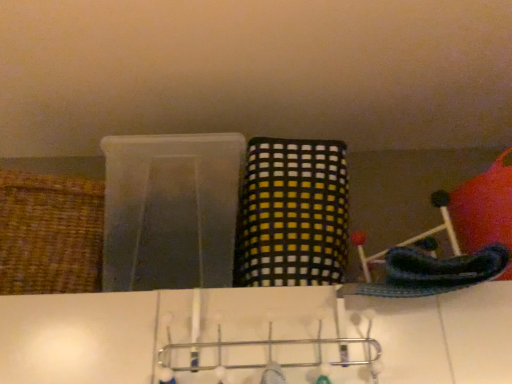
Measure the distance between yellow checkered fabric basket at center, which appears as the 2th basket when viewed from the left, and camera.

The distance of yellow checkered fabric basket at center, which appears as the 2th basket when viewed from the left, from camera is 3.33 feet.

Find the location of `metallic silver hanger at center`. metallic silver hanger at center is located at coordinates (269, 353).

Which of these two, woven brown basket at left, which ranks as the second basket in right-to-left order, or yellow checkered fabric basket at center, which is the first basket in right-to-left order, is thinner?

yellow checkered fabric basket at center, which is the first basket in right-to-left order.

You are a GUI agent. You are given a task and a screenshot of the screen. Output one action in this format:
    pyautogui.click(x=<x>, y=<y>)
    Task: Click on the basket below the yellow checkered fabric basket at center, which appears as the 2th basket when viewed from the left (from a real-world perspective)
    This screenshot has width=512, height=384.
    Given the screenshot: What is the action you would take?
    pyautogui.click(x=50, y=234)

Which is more to the right, woven brown basket at left, which ranks as the 1th basket in left-to-right order, or yellow checkered fabric basket at center, which appears as the 2th basket when viewed from the left?

yellow checkered fabric basket at center, which appears as the 2th basket when viewed from the left, is more to the right.

Considering the relative positions of woven brown basket at left, which ranks as the second basket in right-to-left order, and yellow checkered fabric basket at center, which appears as the 2th basket when viewed from the left, in the image provided, is woven brown basket at left, which ranks as the second basket in right-to-left order, behind yellow checkered fabric basket at center, which appears as the 2th basket when viewed from the left,?

No.

From a real-world perspective, is yellow checkered fabric basket at center, which appears as the 2th basket when viewed from the left, on woven brown basket at left, which ranks as the 1th basket in left-to-right order?

Indeed, from a real-world perspective, yellow checkered fabric basket at center, which appears as the 2th basket when viewed from the left, stands above woven brown basket at left, which ranks as the 1th basket in left-to-right order.

I want to click on basket on the left of yellow checkered fabric basket at center, which appears as the 2th basket when viewed from the left, so click(50, 234).

Is yellow checkered fabric basket at center, which appears as the 2th basket when viewed from the left, not within woven brown basket at left, which ranks as the second basket in right-to-left order?

Yes, yellow checkered fabric basket at center, which appears as the 2th basket when viewed from the left, is outside of woven brown basket at left, which ranks as the second basket in right-to-left order.

Consider the image. Are yellow checkered fabric basket at center, which appears as the 2th basket when viewed from the left, and woven brown basket at left, which ranks as the second basket in right-to-left order, located far from each other?

yellow checkered fabric basket at center, which appears as the 2th basket when viewed from the left, is actually quite close to woven brown basket at left, which ranks as the second basket in right-to-left order.

Is metallic silver hanger at center not near yellow checkered fabric basket at center, which is the first basket in right-to-left order?

metallic silver hanger at center is near yellow checkered fabric basket at center, which is the first basket in right-to-left order, not far away.

Is metallic silver hanger at center facing away from yellow checkered fabric basket at center, which appears as the 2th basket when viewed from the left?

No.

From the image's perspective, is metallic silver hanger at center beneath yellow checkered fabric basket at center, which appears as the 2th basket when viewed from the left?

Indeed, from the image's perspective, metallic silver hanger at center is shown beneath yellow checkered fabric basket at center, which appears as the 2th basket when viewed from the left.

Is metallic silver hanger at center bigger than yellow checkered fabric basket at center, which is the first basket in right-to-left order?

No, metallic silver hanger at center is not bigger than yellow checkered fabric basket at center, which is the first basket in right-to-left order.

Is metallic silver hanger at center a part of yellow checkered fabric basket at center, which is the first basket in right-to-left order?

Definitely not — metallic silver hanger at center is not inside yellow checkered fabric basket at center, which is the first basket in right-to-left order.

Is yellow checkered fabric basket at center, which appears as the 2th basket when viewed from the left, oriented towards metallic silver hanger at center?

No, yellow checkered fabric basket at center, which appears as the 2th basket when viewed from the left, is not aimed at metallic silver hanger at center.

Who is smaller, yellow checkered fabric basket at center, which appears as the 2th basket when viewed from the left, or metallic silver hanger at center?

metallic silver hanger at center.

Are yellow checkered fabric basket at center, which is the first basket in right-to-left order, and metallic silver hanger at center beside each other?

yellow checkered fabric basket at center, which is the first basket in right-to-left order, is not next to metallic silver hanger at center, and they're not touching.

Considering the sizes of metallic silver hanger at center and woven brown basket at left, which ranks as the 1th basket in left-to-right order, in the image, is metallic silver hanger at center wider or thinner than woven brown basket at left, which ranks as the 1th basket in left-to-right order,?

Considering their sizes, metallic silver hanger at center looks slimmer than woven brown basket at left, which ranks as the 1th basket in left-to-right order.

In the image, is metallic silver hanger at center positioned in front of or behind woven brown basket at left, which ranks as the second basket in right-to-left order?

metallic silver hanger at center is in front of woven brown basket at left, which ranks as the second basket in right-to-left order.

Is woven brown basket at left, which ranks as the second basket in right-to-left order, located within metallic silver hanger at center?

Actually, woven brown basket at left, which ranks as the second basket in right-to-left order, is outside metallic silver hanger at center.

Which object is thinner, woven brown basket at left, which ranks as the 1th basket in left-to-right order, or metallic silver hanger at center?

Thinner between the two is metallic silver hanger at center.

How many degrees apart are the facing directions of woven brown basket at left, which ranks as the second basket in right-to-left order, and metallic silver hanger at center?

woven brown basket at left, which ranks as the second basket in right-to-left order, and metallic silver hanger at center are facing 8.93 degrees away from each other.

Is woven brown basket at left, which ranks as the 1th basket in left-to-right order, spatially inside metallic silver hanger at center, or outside of it?

woven brown basket at left, which ranks as the 1th basket in left-to-right order, is outside metallic silver hanger at center.

Which is more to the right, woven brown basket at left, which ranks as the 1th basket in left-to-right order, or metallic silver hanger at center?

metallic silver hanger at center.

This screenshot has width=512, height=384. What are the coordinates of `basket located above the woven brown basket at left, which ranks as the 1th basket in left-to-right order (from the image's perspective)` in the screenshot? It's located at (292, 214).

Where is `basket that is above the woven brown basket at left, which ranks as the second basket in right-to-left order (from a real-world perspective)`? This screenshot has height=384, width=512. basket that is above the woven brown basket at left, which ranks as the second basket in right-to-left order (from a real-world perspective) is located at coordinates (292, 214).

Estimate the real-world distances between objects in this image. Which object is closer to yellow checkered fabric basket at center, which appears as the 2th basket when viewed from the left, woven brown basket at left, which ranks as the second basket in right-to-left order, or metallic silver hanger at center?

metallic silver hanger at center is closer to yellow checkered fabric basket at center, which appears as the 2th basket when viewed from the left.

Looking at the image, which one is located closer to woven brown basket at left, which ranks as the second basket in right-to-left order, metallic silver hanger at center or yellow checkered fabric basket at center, which is the first basket in right-to-left order?

metallic silver hanger at center is positioned closer to the anchor woven brown basket at left, which ranks as the second basket in right-to-left order.

Considering their positions, is woven brown basket at left, which ranks as the second basket in right-to-left order, positioned further to metallic silver hanger at center than yellow checkered fabric basket at center, which is the first basket in right-to-left order?

woven brown basket at left, which ranks as the second basket in right-to-left order, lies further to metallic silver hanger at center than the other object.

From the image, which object appears to be nearer to metallic silver hanger at center, yellow checkered fabric basket at center, which is the first basket in right-to-left order, or woven brown basket at left, which ranks as the 1th basket in left-to-right order?

Based on the image, yellow checkered fabric basket at center, which is the first basket in right-to-left order, appears to be nearer to metallic silver hanger at center.

Consider the image. Looking at the image, which one is located further to woven brown basket at left, which ranks as the 1th basket in left-to-right order, yellow checkered fabric basket at center, which appears as the 2th basket when viewed from the left, or metallic silver hanger at center?

Among the two, yellow checkered fabric basket at center, which appears as the 2th basket when viewed from the left, is located further to woven brown basket at left, which ranks as the 1th basket in left-to-right order.

Looking at the image, which one is located further to yellow checkered fabric basket at center, which appears as the 2th basket when viewed from the left, metallic silver hanger at center or woven brown basket at left, which ranks as the second basket in right-to-left order?

The object further to yellow checkered fabric basket at center, which appears as the 2th basket when viewed from the left, is woven brown basket at left, which ranks as the second basket in right-to-left order.

Image resolution: width=512 pixels, height=384 pixels. I want to click on hanger located between woven brown basket at left, which ranks as the second basket in right-to-left order, and yellow checkered fabric basket at center, which is the first basket in right-to-left order, in the left-right direction, so click(269, 353).